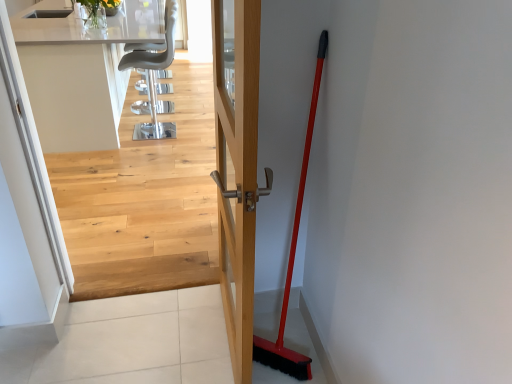
Question: From the image's perspective, relative to red plastic shovel at right, is wooden door handle at center above or below?

Choices:
 (A) below
 (B) above

Answer: (B)

Question: Is wooden door handle at center to the left or to the right of red plastic shovel at right in the image?

Choices:
 (A) left
 (B) right

Answer: (A)

Question: Which is farther from the light wood floor at upper center?

Choices:
 (A) wooden door handle at center
 (B) white glossy countertop at upper center
 (C) red plastic shovel at right
 (D) metallic gray chair at upper center

Answer: (C)

Question: Which object is the farthest from the white glossy countertop at upper center?

Choices:
 (A) wooden door handle at center
 (B) light wood floor at upper center
 (C) red plastic shovel at right
 (D) metallic gray chair at upper center

Answer: (C)